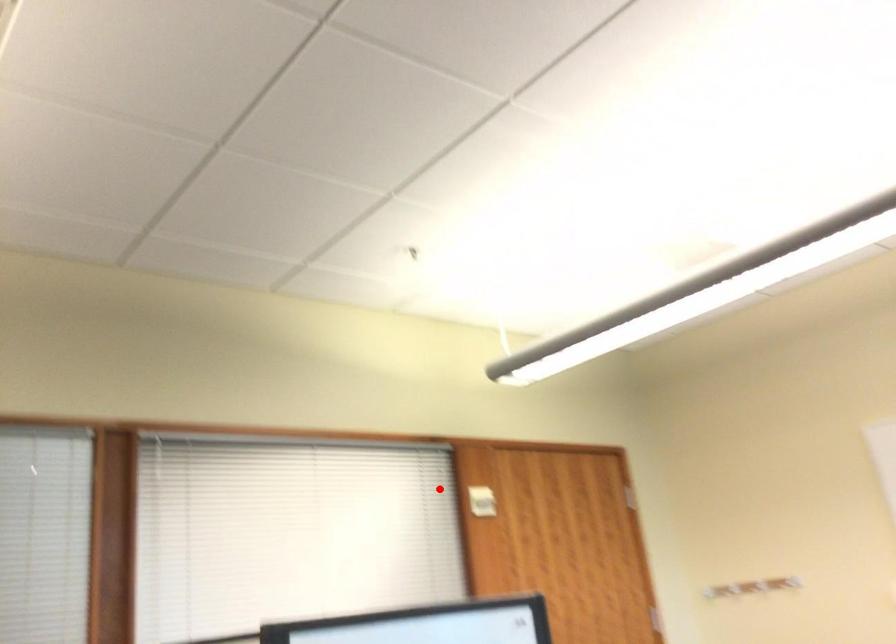
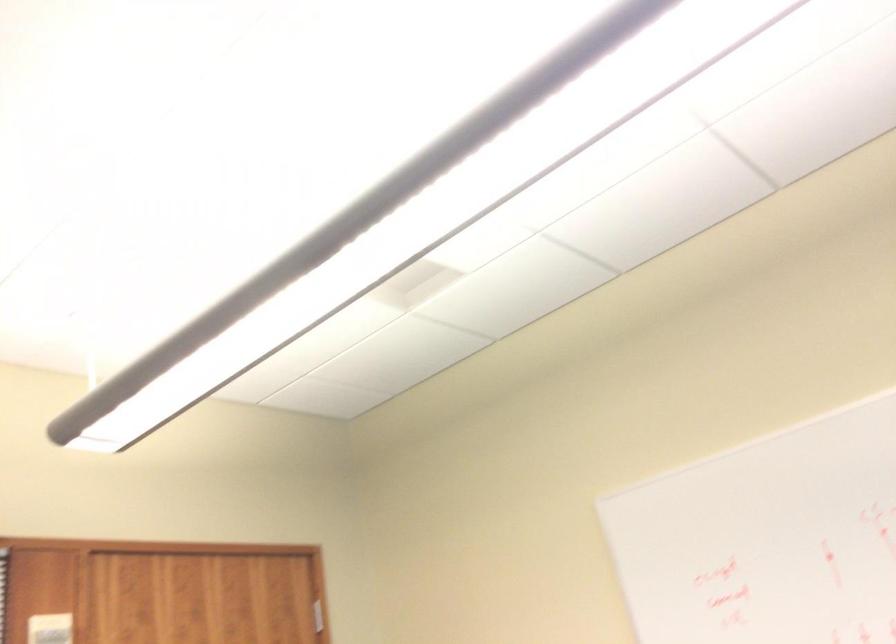
Question: I am providing you with two images of the same scene from different viewpoints. Image1 has a red point marked. In image2, the corresponding 3D location appears at what relative position? Reply with the corresponding letter.

Choices:
 (A) Closer
 (B) Farther

Answer: (A)